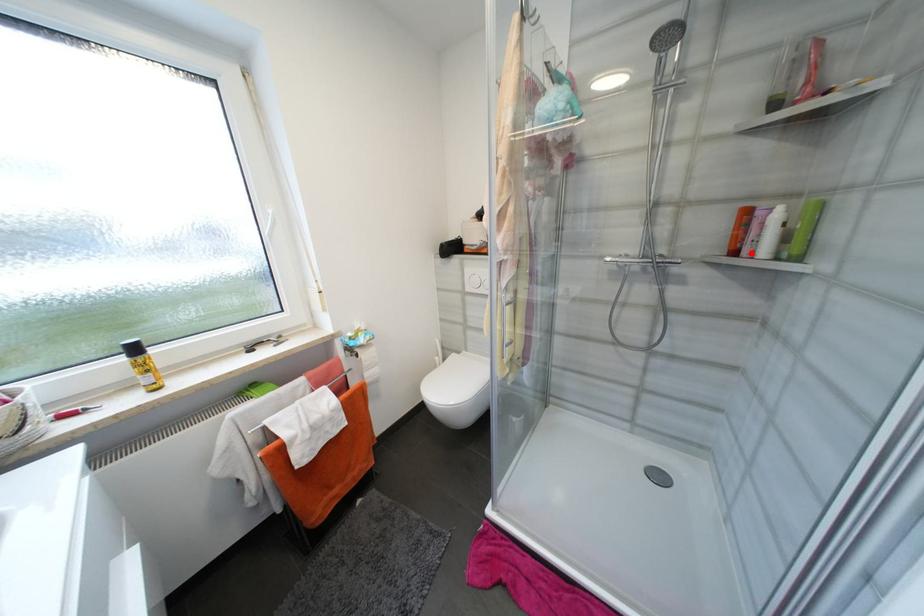
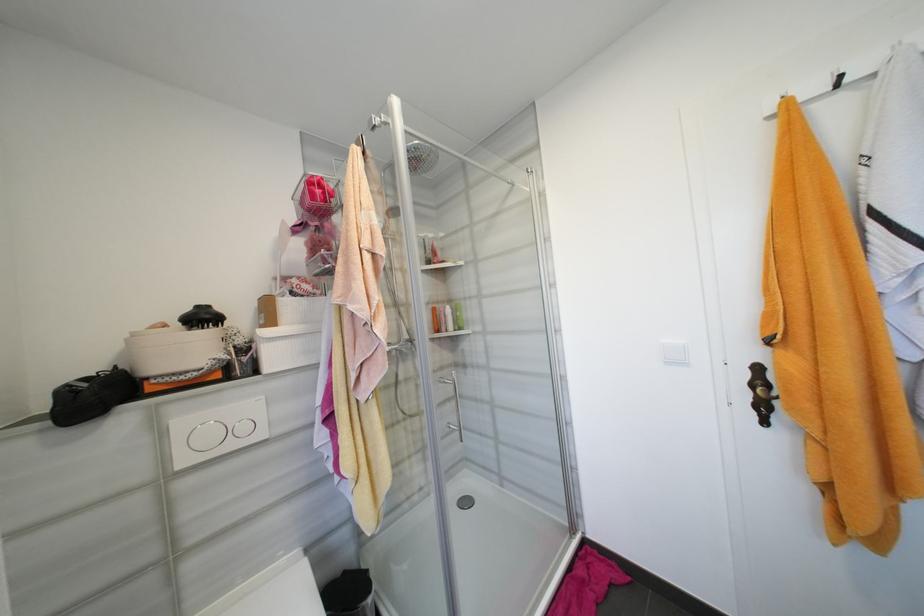
Where in the second image is the point corresponding to the highlighted location from the first image?

(450, 330)